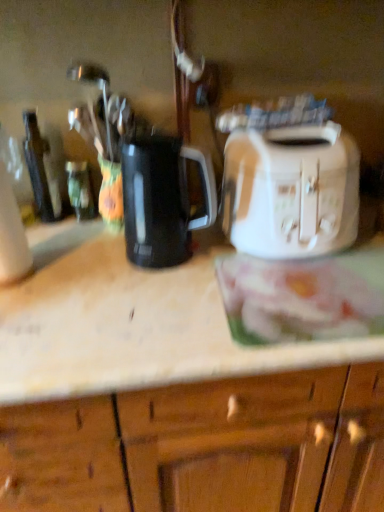
The width and height of the screenshot is (384, 512). I want to click on vacant space that is to the left of white glossy bread at center, so click(x=152, y=303).